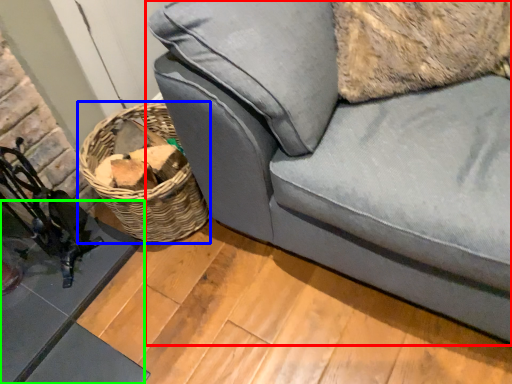
Question: Estimate the real-world distances between objects in this image. Which object is closer to studio couch (highlighted by a red box), basket (highlighted by a blue box) or table (highlighted by a green box)?

Choices:
 (A) basket
 (B) table

Answer: (A)